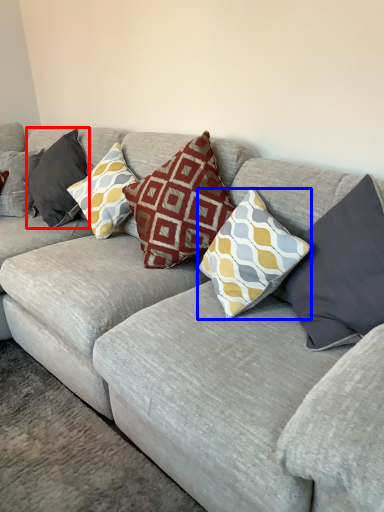
Question: Which object is further to the camera taking this photo, pillow (highlighted by a red box) or pillow (highlighted by a blue box)?

Choices:
 (A) pillow
 (B) pillow

Answer: (A)